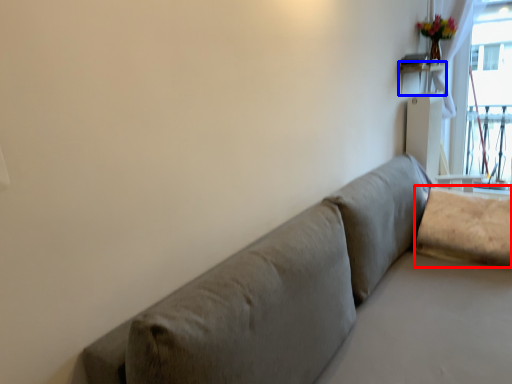
Question: Which point is closer to the camera, pillow (highlighted by a red box) or table (highlighted by a blue box)?

Choices:
 (A) pillow
 (B) table

Answer: (A)